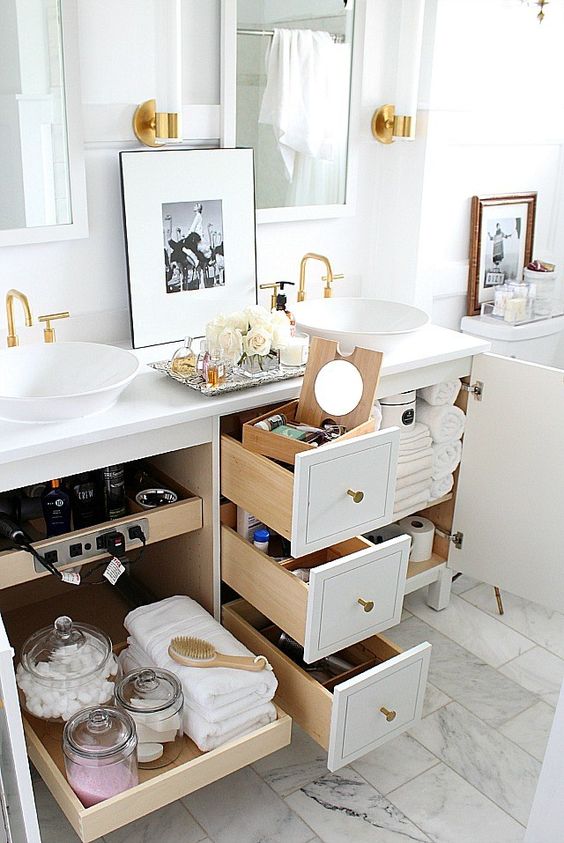
Locate an element on the screen. The width and height of the screenshot is (564, 843). open door is located at coordinates (522, 463).